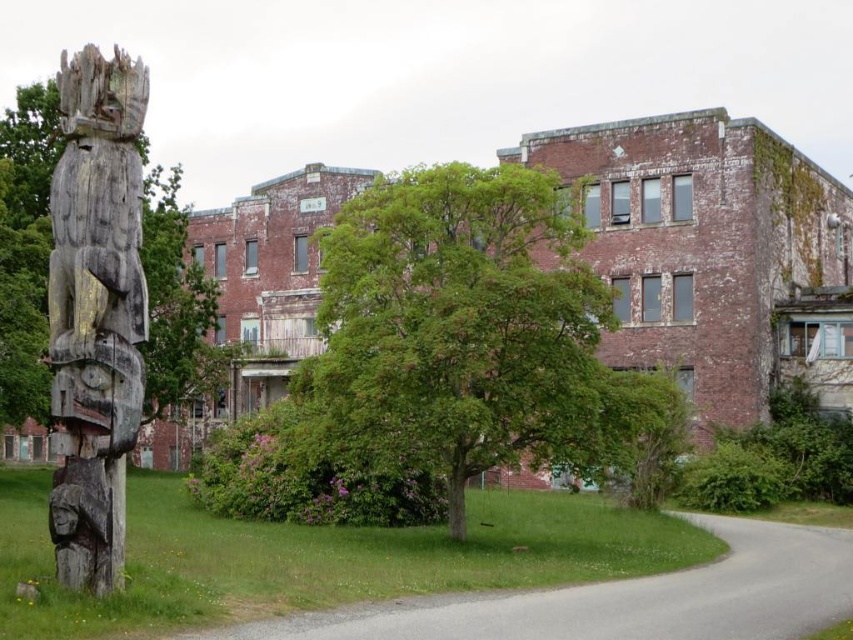
You are standing at the point marked as point (x=457, y=326). What do you see directly in front of you?

You see a green leafy tree at center directly in front of you at point (x=457, y=326).

You are standing in front of the old brick building and see two points marked on the scene. Which point, point (50, 506) or point (148, 362), is closer to you?

Point (50, 506) is closer to the viewer than point (148, 362).

You are standing at the point marked by the coordinates point (457, 326). Looking around, you see a green leafy tree at center. What direction should you face to see the old weathered brick building?

The point (457, 326) marks the green leafy tree at center. Since the old weathered brick building is in the background, facing away from the tree would allow you to see the building.